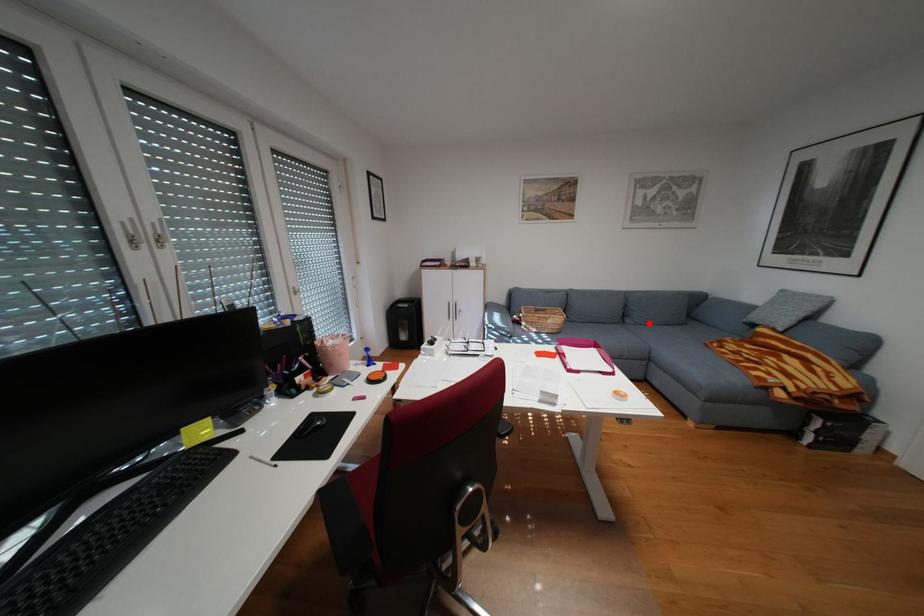
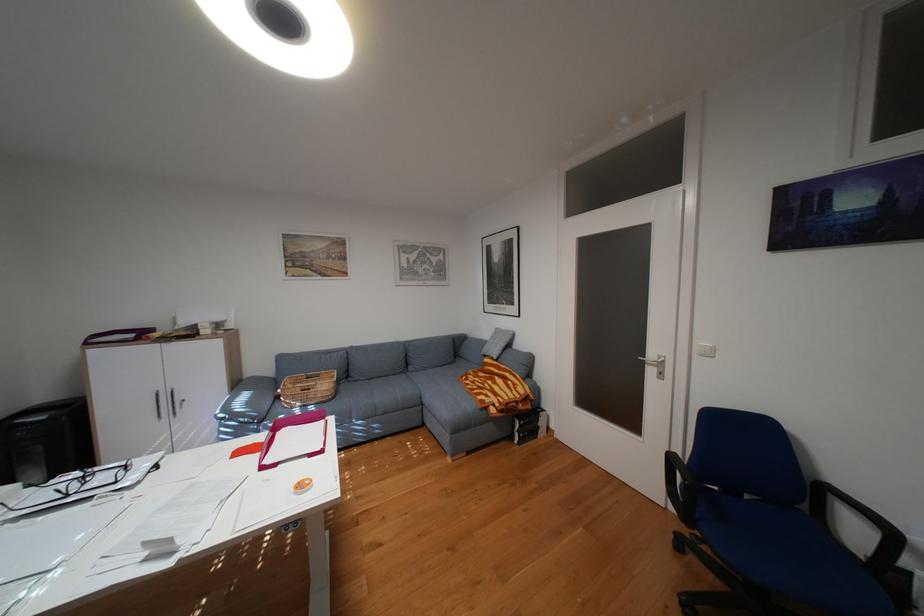
Question: I am providing you with two images of the same scene from different viewpoints. Given a red point in image1, look at the same physical point in image2. Is it:

Choices:
 (A) Closer to the viewpoint
 (B) Farther from the viewpoint

Answer: (A)